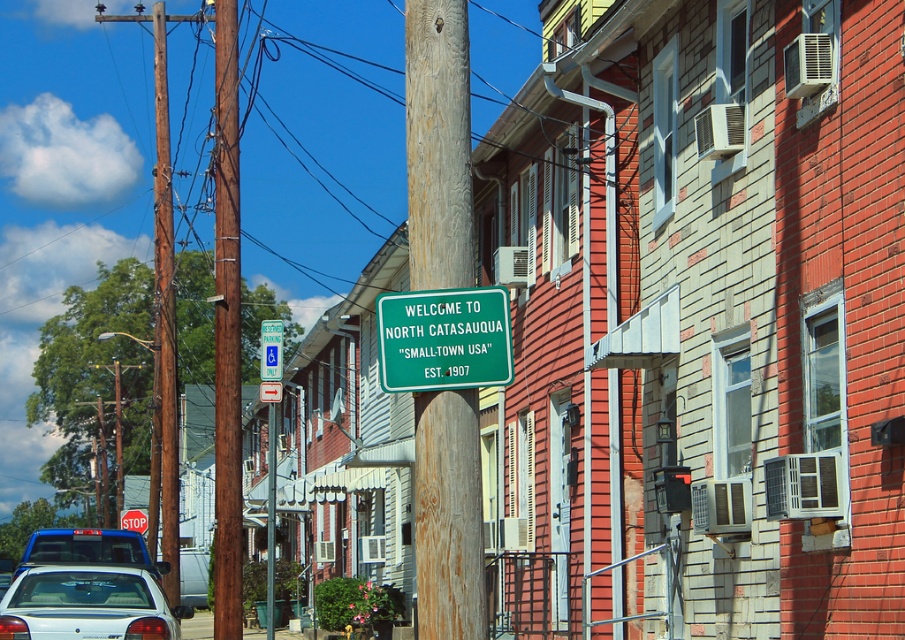
What do you see at coordinates (443, 339) in the screenshot?
I see `green plastic sign at center` at bounding box center [443, 339].

Image resolution: width=905 pixels, height=640 pixels. I want to click on green plastic sign at center, so click(x=443, y=339).

Between point (456, 387) and point (65, 556), which one is positioned behind?

Point (65, 556)

This screenshot has height=640, width=905. Identify the location of green plastic sign at center. (443, 339).

What do you see at coordinates (437, 145) in the screenshot? I see `wooden post at center` at bounding box center [437, 145].

Is wooden post at center smaller than green plastic sign at center?

Actually, wooden post at center might be larger than green plastic sign at center.

Does point (477, 444) lie in front of point (375, 300)?

That is True.

Where is `wooden post at center`? wooden post at center is located at coordinates (437, 145).

Can you confirm if brown wooden telegraph pole at center is positioned to the right of white glossy sedan at lower left?

Result: In fact, brown wooden telegraph pole at center is to the left of white glossy sedan at lower left.

Who is shorter, brown wooden telegraph pole at center or white glossy sedan at lower left?

white glossy sedan at lower left is shorter.

Does point (224, 362) come closer to viewer compared to point (62, 634)?

No, it is behind (62, 634).

Where is `brown wooden telegraph pole at center`? This screenshot has height=640, width=905. brown wooden telegraph pole at center is located at coordinates (227, 333).